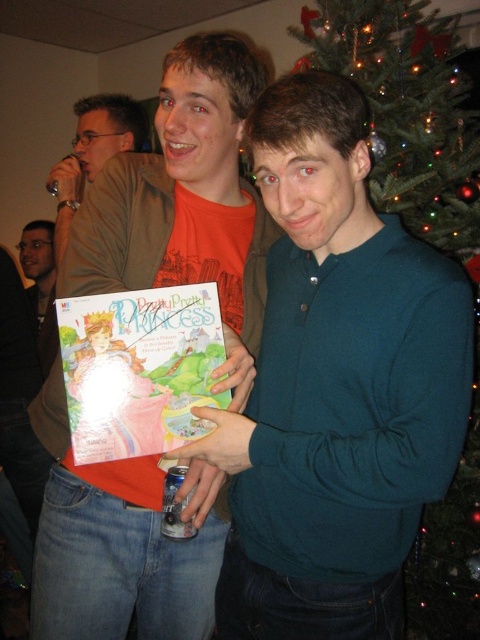
In the scene shown: Can you confirm if matte khaki shirt at left is positioned above matte black face at left?

Correct, matte khaki shirt at left is located above matte black face at left.

Identify the location of matte khaki shirt at left. This screenshot has width=480, height=640. (93, 152).

Locate an element on the screen. This screenshot has width=480, height=640. matte khaki shirt at left is located at coordinates (93, 152).

Between matte orange shirt at center and green artificial christmas tree at upper right, which one has less height?

matte orange shirt at center is shorter.

Can you confirm if matte orange shirt at center is positioned above green artificial christmas tree at upper right?

Incorrect, matte orange shirt at center is not positioned above green artificial christmas tree at upper right.

Find the location of `matte orange shirt at center`. matte orange shirt at center is located at coordinates click(x=182, y=193).

Where is `matte orange shirt at center`? This screenshot has width=480, height=640. matte orange shirt at center is located at coordinates (182, 193).

Between green artificial christmas tree at upper right and matte khaki shirt at left, which one appears on the left side from the viewer's perspective?

matte khaki shirt at left is more to the left.

Which is in front, point (464, 108) or point (87, 113)?

Point (87, 113) is more forward.

At what (x,y) coordinates should I click in order to perform the action: click on green artificial christmas tree at upper right. Please return your answer as a coordinate pair (x, y). Image resolution: width=480 pixels, height=640 pixels. Looking at the image, I should click on (409, 109).